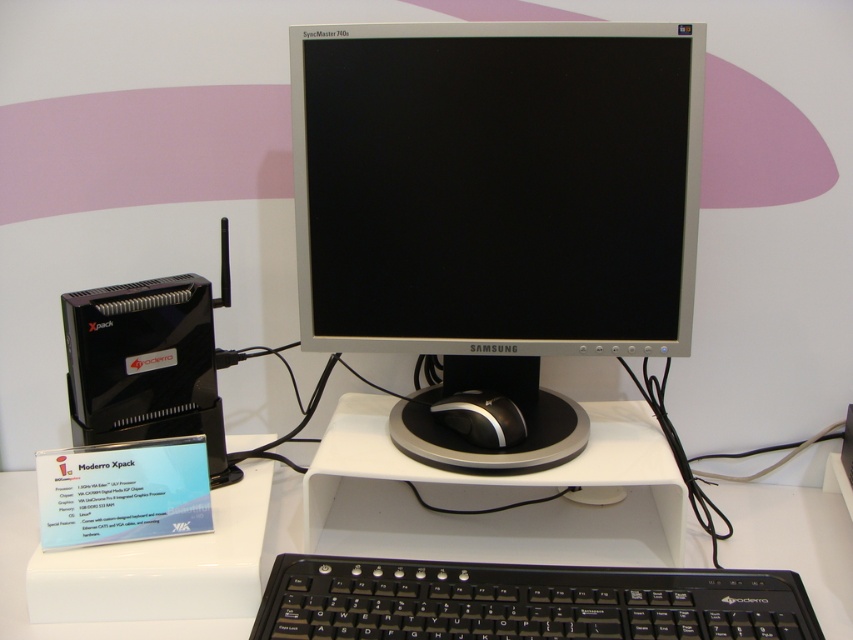
Question: Considering the relative positions of white plastic computer desk at center and black plastic modero xpack at left in the image provided, where is white plastic computer desk at center located with respect to black plastic modero xpack at left?

Choices:
 (A) above
 (B) below

Answer: (B)

Question: Is silver metallic monitor at center wider than black plastic modero xpack at left?

Choices:
 (A) yes
 (B) no

Answer: (A)

Question: Which object is positioned closest to the black glossy mouse at center?

Choices:
 (A) black plastic keyboard at lower center
 (B) black plastic modero xpack at left
 (C) white plastic computer desk at center
 (D) silver metallic monitor at center

Answer: (D)

Question: Among these points, which one is farthest from the camera?

Choices:
 (A) (97, 420)
 (B) (425, 346)
 (C) (51, 625)

Answer: (B)

Question: Which point is closer to the camera?

Choices:
 (A) black glossy mouse at center
 (B) white plastic computer desk at center
 (C) silver metallic monitor at center

Answer: (B)

Question: Does silver metallic monitor at center appear on the right side of black glossy mouse at center?

Choices:
 (A) yes
 (B) no

Answer: (A)